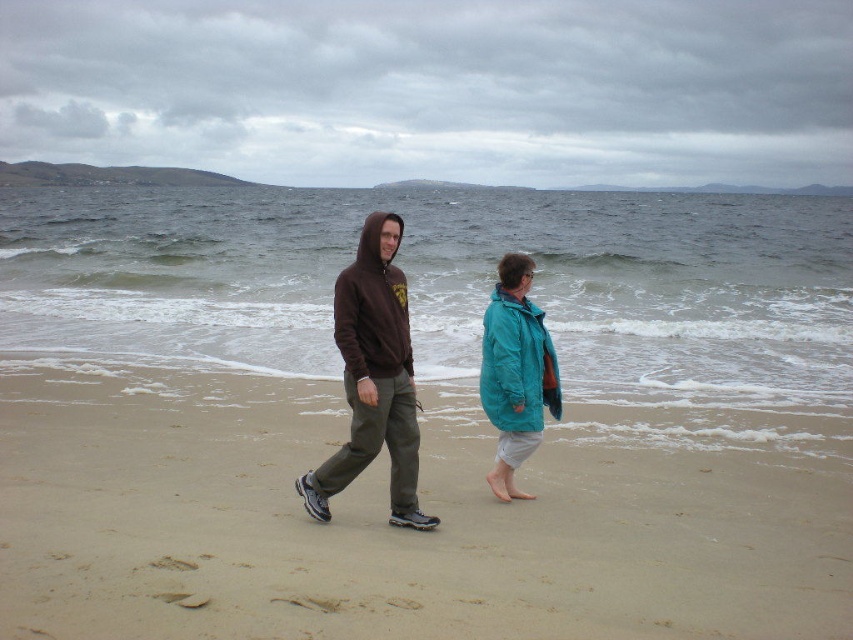
You are standing at the point marked as point (444, 284) on the beach. Which direction should you walk to reach the grayish blue water at center?

The grayish blue water at center is located at point (444, 284), so you are already at the location of the grayish blue water at center. Therefore, you don not need to walk in any direction to reach it.

You are standing on the beach and see two points marked on the sand. The first point is labeled as point (845, 232) and the second is point (538, 364). Which point is closer to you?

Point (845, 232) is closer to you because it is further to the viewer than point (538, 364).